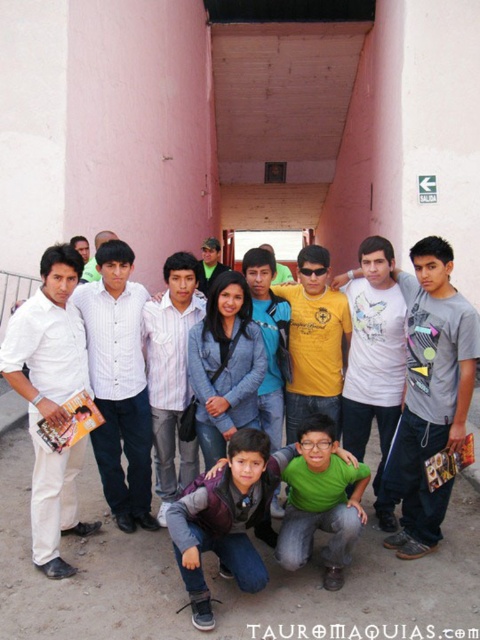
Who is positioned more to the right, gray cotton t-shirt at center or white matte shirt at left?

gray cotton t-shirt at center

The height and width of the screenshot is (640, 480). I want to click on gray cotton t-shirt at center, so click(x=431, y=392).

Between point (188, 328) and point (278, 268), which one is positioned behind?

Positioned behind is point (278, 268).

Which is in front, point (181, 442) or point (273, 284)?

Positioned in front is point (181, 442).

The image size is (480, 640). I want to click on striped cotton shirt at center, so click(170, 372).

Is white striped shirt at center to the left of striped cotton shirt at center from the viewer's perspective?

Yes, white striped shirt at center is to the left of striped cotton shirt at center.

Between white striped shirt at center and striped cotton shirt at center, which one has less height?

striped cotton shirt at center

Which is behind, point (118, 278) or point (156, 360)?

Point (156, 360)

Locate an element on the screen. white striped shirt at center is located at coordinates [119, 385].